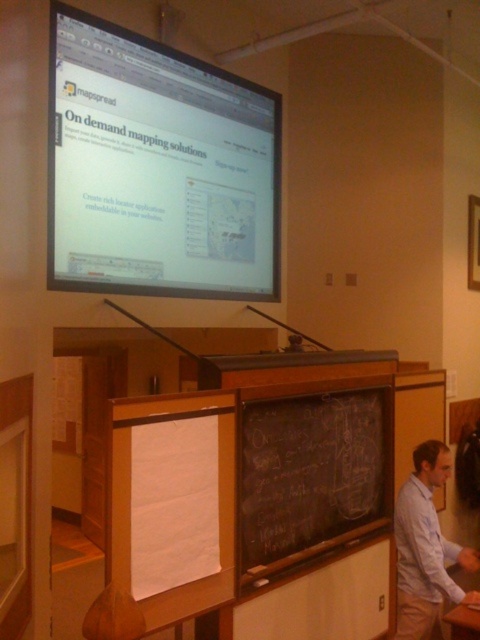
Between matte black screen at upper center and black chalkboard at center, which one is positioned lower?

black chalkboard at center

Is point (210, 227) positioned after point (345, 429)?

Yes, it is behind point (345, 429).

Locate an element on the screen. This screenshot has height=640, width=480. matte black screen at upper center is located at coordinates pos(157,168).

Describe the element at coordinates (425, 548) in the screenshot. I see `light blue shirt at lower right` at that location.

Between point (466, 547) and point (477, 621), which one is positioned behind?

The point (466, 547) is more distant.

The image size is (480, 640). Find the location of `light blue shirt at lower right`. light blue shirt at lower right is located at coordinates (425, 548).

Is black chalkboard at center thinner than wooden table at lower right?

No.

Is point (384, 429) positioned before point (466, 616)?

No, it is not.

Which is in front, point (297, 410) or point (460, 609)?

Positioned in front is point (460, 609).

Where is `black chalkboard at center`? The width and height of the screenshot is (480, 640). black chalkboard at center is located at coordinates (310, 474).